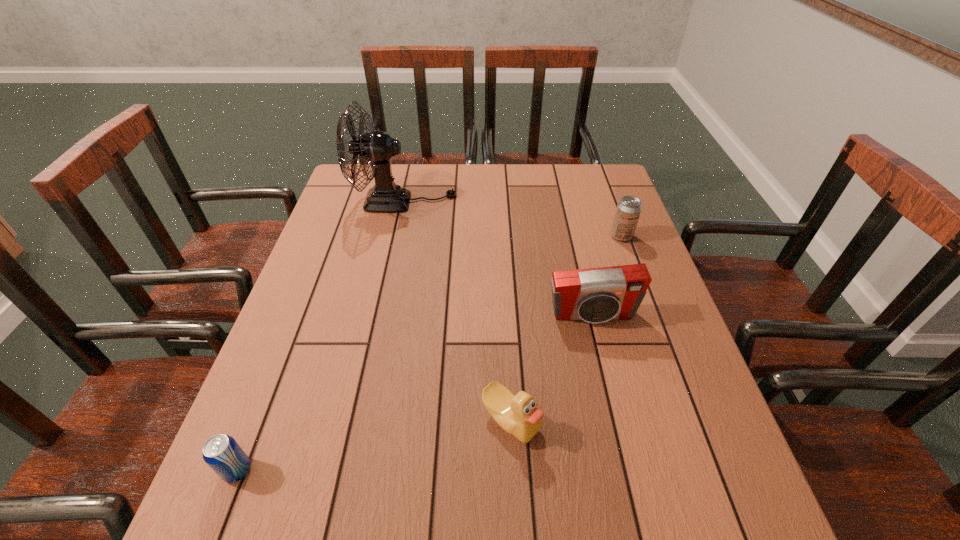
The width and height of the screenshot is (960, 540). Find the location of `object that is at the far left corner`. object that is at the far left corner is located at coordinates (377, 148).

The width and height of the screenshot is (960, 540). Identify the location of free space at the far edge of the desktop. (408, 184).

This screenshot has width=960, height=540. In the image, there is a desktop. In order to click on free region at the near edge in this screenshot , I will do `click(654, 522)`.

The height and width of the screenshot is (540, 960). In the image, there is a desktop. What are the coordinates of `vacant area at the left edge` in the screenshot? It's located at (328, 293).

Locate an element on the screen. Image resolution: width=960 pixels, height=540 pixels. blank space at the right edge of the desktop is located at coordinates (694, 373).

Where is `vacant area at the far left corner`? The width and height of the screenshot is (960, 540). vacant area at the far left corner is located at coordinates (372, 183).

Identify the location of vacant space at the near left corner of the desktop. This screenshot has width=960, height=540. (247, 533).

Locate an element on the screen. The width and height of the screenshot is (960, 540). vacant space at the far right corner of the desktop is located at coordinates (588, 183).

Where is `vacant space in between the farther beer can and the second nearest object`? This screenshot has width=960, height=540. vacant space in between the farther beer can and the second nearest object is located at coordinates (566, 328).

Locate an element on the screen. The width and height of the screenshot is (960, 540). vacant space that is in between the camera and the duck is located at coordinates (552, 368).